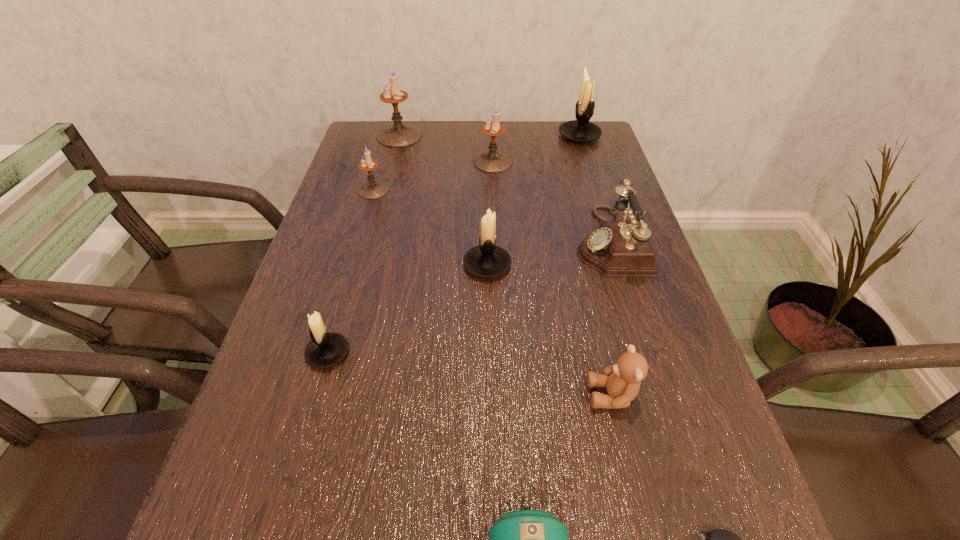
Where is `the leftmost white candle holder`? The width and height of the screenshot is (960, 540). the leftmost white candle holder is located at coordinates (325, 350).

Locate an element on the screen. The height and width of the screenshot is (540, 960). the fourth nearest object is located at coordinates (325, 350).

This screenshot has width=960, height=540. I want to click on the third nearest object, so click(622, 380).

What are the coordinates of `teddy bear` in the screenshot? It's located at (622, 380).

Locate an element on the screen. This screenshot has width=960, height=540. vacant area located 0.290m on the right of the biggest purple candle holder is located at coordinates (515, 136).

Find the location of a particular element. This screenshot has width=960, height=540. free location located on the left of the rightmost white candle holder is located at coordinates [x=514, y=136].

You are a GUI agent. You are given a task and a screenshot of the screen. Output one action in this format:
    pyautogui.click(x=<x>, y=<y>)
    Task: Click on the free space located 0.220m on the right of the third farthest candle holder
    
    Given the screenshot: What is the action you would take?
    pyautogui.click(x=588, y=162)

Locate an element on the screen. free point located 0.240m on the back of the second farthest white candle holder is located at coordinates (486, 188).

Find the location of a particular element. free region located 0.300m on the dial of the telephone is located at coordinates (445, 241).

Locate an element on the screen. The image size is (960, 540). vacant space situated 0.130m on the dial of the telephone is located at coordinates (518, 241).